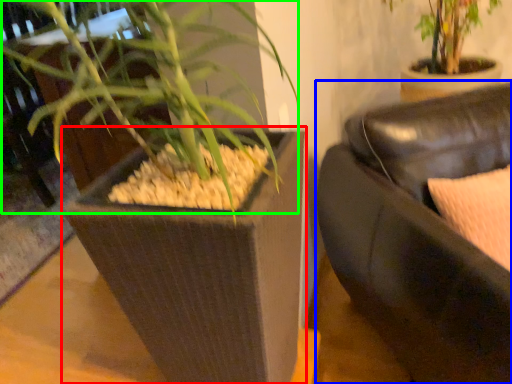
Question: Considering the real-world distances, which object is closest to flowerpot (highlighted by a red box)? studio couch (highlighted by a blue box) or orchid (highlighted by a green box).

Choices:
 (A) studio couch
 (B) orchid

Answer: (B)